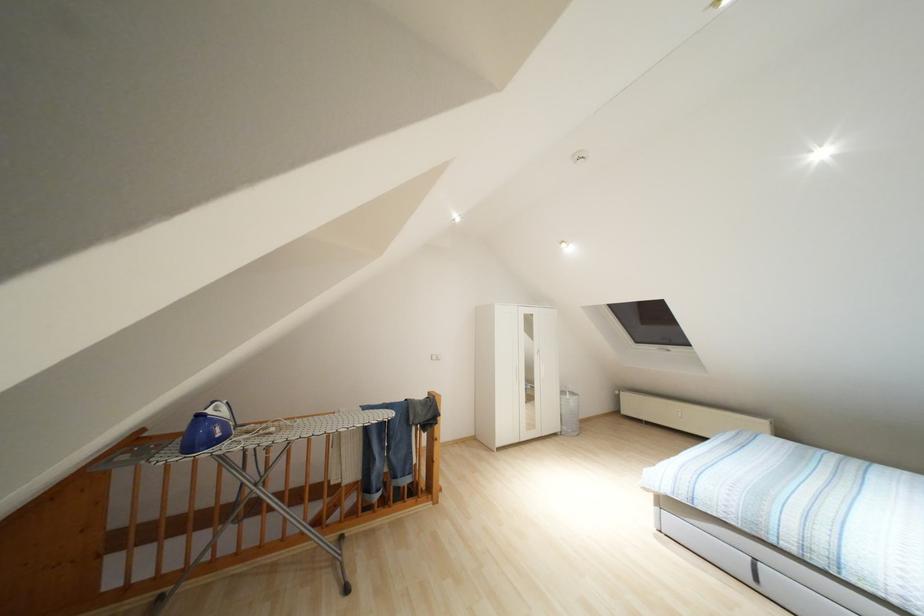
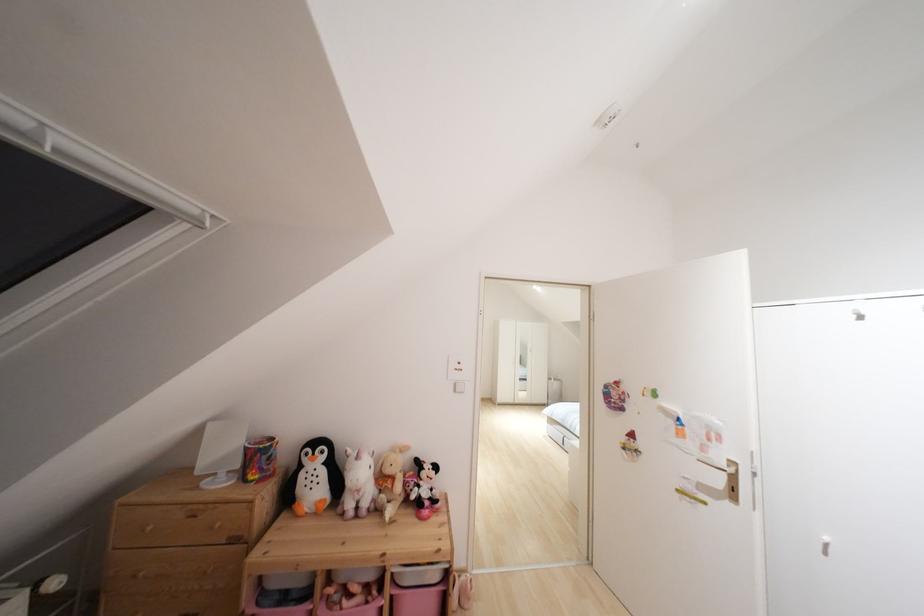
From the picture: Which direction would the cameraman need to move to produce the second image?

The cameraman walked toward right, backward.